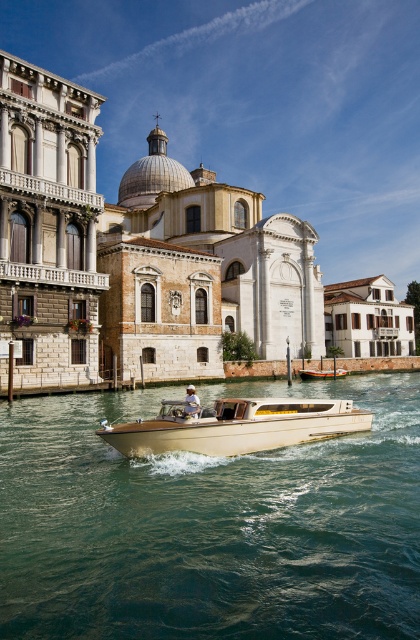
You are a tourist planning to take a boat tour along the canal. You see two boats available for hire at the center of the scene. The beige polished wood boat at center and the wooden polished boat at center. Which boat should you choose if you want the larger one?

The beige polished wood boat at center is bigger than the wooden polished boat at center, so you should choose the beige polished wood boat at center.